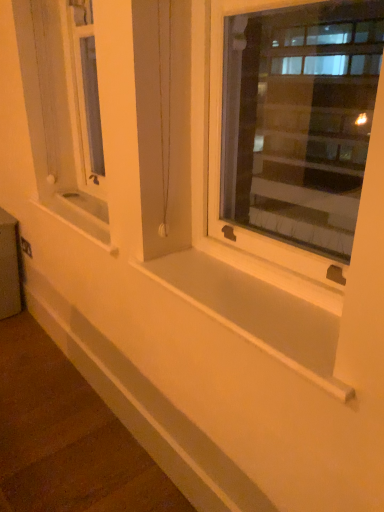
The image size is (384, 512). Describe the element at coordinates (80, 215) in the screenshot. I see `white smooth window sill at center, the first window sill from the top` at that location.

This screenshot has height=512, width=384. Identify the location of white smooth ledge at lower center. (147, 411).

The height and width of the screenshot is (512, 384). Find the location of `white plastic window at center`. white plastic window at center is located at coordinates [291, 125].

From the image's perspective, which is below, white smooth ledge at lower center or metallic silver window box at lower left?

white smooth ledge at lower center.

From a real-world perspective, does white smooth ledge at lower center stand above metallic silver window box at lower left?

Incorrect, from a real-world perspective, white smooth ledge at lower center is lower than metallic silver window box at lower left.

Can you confirm if white smooth ledge at lower center is taller than metallic silver window box at lower left?

Incorrect, the height of white smooth ledge at lower center is not larger of that of metallic silver window box at lower left.

Considering the relative sizes of white smooth ledge at lower center and metallic silver window box at lower left in the image provided, is white smooth ledge at lower center bigger than metallic silver window box at lower left?

No, white smooth ledge at lower center is not bigger than metallic silver window box at lower left.

Considering the points (76, 309) and (51, 208), which point is in front, point (76, 309) or point (51, 208)?

The point (51, 208) is closer to the camera.

Are white smooth ledge at lower center and white smooth window sill at center, the second window sill positioned from the bottom, located far from each other?

No, white smooth ledge at lower center is not far from white smooth window sill at center, the second window sill positioned from the bottom.

Where is `ledge in front of the white smooth window sill at center, which is the 1th window sill from left to right`? ledge in front of the white smooth window sill at center, which is the 1th window sill from left to right is located at coordinates (147, 411).

From a real-world perspective, does white smooth window sill at center, positioned as the 2th window sill in back-to-front order, stand above white smooth ledge at lower center?

Correct, in the physical world, white smooth window sill at center, positioned as the 2th window sill in back-to-front order, is higher than white smooth ledge at lower center.

Can you see white smooth window sill at center, positioned as the 2th window sill in back-to-front order, touching white smooth ledge at lower center?

No, white smooth window sill at center, positioned as the 2th window sill in back-to-front order, is not beside white smooth ledge at lower center.

Considering the relative positions of white smooth window sill at center, positioned as the 2th window sill in back-to-front order, and white smooth ledge at lower center in the image provided, is white smooth window sill at center, positioned as the 2th window sill in back-to-front order, to the left or to the right of white smooth ledge at lower center?

Based on their positions, white smooth window sill at center, positioned as the 2th window sill in back-to-front order, is located to the right of white smooth ledge at lower center.

Looking at this image, from the image's perspective, is white smooth window sill at center, which appears as the 2th window sill when viewed from the left, under white smooth ledge at lower center?

No, from the image's perspective, white smooth window sill at center, which appears as the 2th window sill when viewed from the left, is not below white smooth ledge at lower center.

Which of these two, metallic silver window box at lower left or white plastic window at center, is bigger?

With larger size is metallic silver window box at lower left.

Which object is thinner, metallic silver window box at lower left or white plastic window at center?

With smaller width is white plastic window at center.

Looking at this image, can you see metallic silver window box at lower left touching white plastic window at center?

No.

Consider the image. Is white smooth window sill at center, positioned as the 2th window sill in back-to-front order, turned away from white smooth window sill at center, which is the 1th window sill from left to right?

That's not correct — white smooth window sill at center, positioned as the 2th window sill in back-to-front order, is not looking away from white smooth window sill at center, which is the 1th window sill from left to right.

What's the angular difference between white smooth window sill at center, positioned as the 2th window sill in back-to-front order, and white smooth window sill at center, which is the 1th window sill from left to right,'s facing directions?

They differ by 0.00423 degrees in their facing directions.

Is white smooth window sill at center, which appears as the 2th window sill when viewed from the left, positioned in front of white smooth window sill at center, which is counted as the second window sill, starting from the right?

Yes, white smooth window sill at center, which appears as the 2th window sill when viewed from the left, is closer to the viewer.

Who is taller, white smooth window sill at center, which is the 2th window sill from top to bottom, or white smooth window sill at center, which is counted as the first window sill, starting from the back?

white smooth window sill at center, which is counted as the first window sill, starting from the back, is taller.

Between white smooth window sill at center, acting as the 1th window sill starting from the front, and metallic silver window box at lower left, which one is positioned in front?

white smooth window sill at center, acting as the 1th window sill starting from the front, is more forward.

Is white smooth window sill at center, which appears as the 2th window sill when viewed from the left, inside or outside of metallic silver window box at lower left?

white smooth window sill at center, which appears as the 2th window sill when viewed from the left, cannot be found inside metallic silver window box at lower left.

Locate an element on the screen. This screenshot has width=384, height=512. window box above the white smooth window sill at center, acting as the 1th window sill starting from the front (from the image's perspective) is located at coordinates (9, 267).

From the image's perspective, is white smooth window sill at center, which is the 1th window sill in bottom-to-top order, beneath metallic silver window box at lower left?

Yes, from the image's perspective, white smooth window sill at center, which is the 1th window sill in bottom-to-top order, is beneath metallic silver window box at lower left.

Considering the relative sizes of white smooth window sill at center, which is the 2th window sill from top to bottom, and white plastic window at center in the image provided, is white smooth window sill at center, which is the 2th window sill from top to bottom, taller than white plastic window at center?

Incorrect, the height of white smooth window sill at center, which is the 2th window sill from top to bottom, is not larger of that of white plastic window at center.

Considering the relative positions of white smooth window sill at center, positioned as the 2th window sill in back-to-front order, and white plastic window at center in the image provided, is white smooth window sill at center, positioned as the 2th window sill in back-to-front order, behind white plastic window at center?

Yes, it is behind white plastic window at center.

From a real-world perspective, which is physically below, white smooth window sill at center, positioned as the 2th window sill in back-to-front order, or white plastic window at center?

white smooth window sill at center, positioned as the 2th window sill in back-to-front order, is physically lower.

There is a white smooth ledge at lower center. Where is `window box above it (from a real-world perspective)`? window box above it (from a real-world perspective) is located at coordinates (9, 267).

Identify the location of the 1st window sill to the right of the white smooth ledge at lower center, counting from the anchor's position. The width and height of the screenshot is (384, 512). (80, 215).

Considering their positions, is white smooth window sill at center, acting as the 1th window sill starting from the front, positioned closer to white plastic window at center than white smooth ledge at lower center?

white smooth ledge at lower center.

Based on their spatial positions, is white smooth ledge at lower center or metallic silver window box at lower left closer to white plastic window at center?

Based on the image, metallic silver window box at lower left appears to be nearer to white plastic window at center.

Based on their spatial positions, is white smooth window sill at center, which is counted as the second window sill, starting from the right, or white plastic window at center closer to white smooth window sill at center, which is the 1th window sill in bottom-to-top order?

Based on the image, white smooth window sill at center, which is counted as the second window sill, starting from the right, appears to be nearer to white smooth window sill at center, which is the 1th window sill in bottom-to-top order.

Estimate the real-world distances between objects in this image. Which object is further from white plastic window at center, metallic silver window box at lower left or white smooth ledge at lower center?

Among the two, white smooth ledge at lower center is located further to white plastic window at center.

Considering their positions, is metallic silver window box at lower left positioned further to white plastic window at center than white smooth window sill at center, marked as the second window sill in a front-to-back arrangement?

white smooth window sill at center, marked as the second window sill in a front-to-back arrangement, is further to white plastic window at center.

Which object lies nearer to the anchor point metallic silver window box at lower left, white smooth window sill at center, which is counted as the second window sill, starting from the right, or white plastic window at center?

The object closer to metallic silver window box at lower left is white smooth window sill at center, which is counted as the second window sill, starting from the right.

Based on the photo, estimate the real-world distances between objects in this image. Which object is closer to white smooth window sill at center, which is the 2th window sill from top to bottom, white plastic window at center or white smooth ledge at lower center?

white smooth ledge at lower center is positioned closer to the anchor white smooth window sill at center, which is the 2th window sill from top to bottom.

Estimate the real-world distances between objects in this image. Which object is closer to white smooth window sill at center, the second window sill positioned from the bottom, white plastic window at center or metallic silver window box at lower left?

Based on the image, metallic silver window box at lower left appears to be nearer to white smooth window sill at center, the second window sill positioned from the bottom.

The width and height of the screenshot is (384, 512). Identify the location of ledge between white plastic window at center and metallic silver window box at lower left in the front-back direction. (147, 411).

Find the location of a particular element. window sill between white smooth ledge at lower center and metallic silver window box at lower left from front to back is located at coordinates (80, 215).

Locate an element on the screen. This screenshot has width=384, height=512. ledge positioned between white smooth window sill at center, positioned as the 2th window sill in back-to-front order, and metallic silver window box at lower left from near to far is located at coordinates (147, 411).

The width and height of the screenshot is (384, 512). What are the coordinates of `window sill between white smooth window sill at center, which is the 2th window sill from top to bottom, and metallic silver window box at lower left, along the z-axis` in the screenshot? It's located at (80, 215).